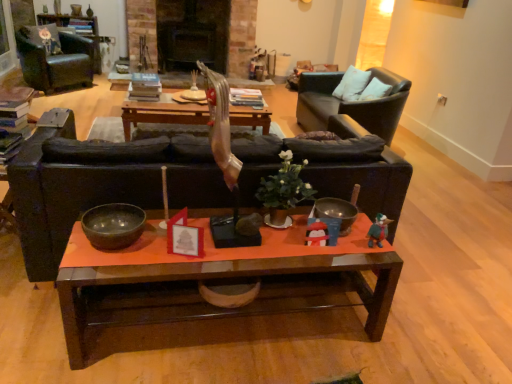
Question: Would you say plush green duck at right is part of white soft pillow at upper right, placed as the first pillow when sorted from front to back,'s contents?

Choices:
 (A) no
 (B) yes

Answer: (A)

Question: Is white soft pillow at upper right, the 2th pillow viewed from the left, next to plush green duck at right?

Choices:
 (A) no
 (B) yes

Answer: (A)

Question: Is white soft pillow at upper right, placed as the first pillow when sorted from front to back, facing away from plush green duck at right?

Choices:
 (A) no
 (B) yes

Answer: (A)

Question: Does white soft pillow at upper right, placed as the first pillow when sorted from front to back, appear on the right side of plush green duck at right?

Choices:
 (A) no
 (B) yes

Answer: (B)

Question: Is white soft pillow at upper right, positioned as the 1th pillow in right-to-left order, thinner than plush green duck at right?

Choices:
 (A) no
 (B) yes

Answer: (A)

Question: Relative to plush green duck at right, is wooden coffee table at center, which is the second coffee table from front to back, in front or behind?

Choices:
 (A) front
 (B) behind

Answer: (B)

Question: Choose the correct answer: Is wooden coffee table at center, which is the second coffee table from front to back, inside plush green duck at right or outside it?

Choices:
 (A) inside
 (B) outside

Answer: (B)

Question: Considering the positions of point (249, 122) and point (377, 228), is point (249, 122) closer or farther from the camera than point (377, 228)?

Choices:
 (A) closer
 (B) farther

Answer: (B)

Question: In terms of size, does wooden coffee table at center, which ranks as the 1th coffee table in back-to-front order, appear bigger or smaller than plush green duck at right?

Choices:
 (A) big
 (B) small

Answer: (A)

Question: Does point (88, 226) appear closer or farther from the camera than point (390, 221)?

Choices:
 (A) closer
 (B) farther

Answer: (A)

Question: Based on their sizes in the image, would you say shiny dark wood bowl at center, placed as the second bowl when sorted from right to left, is bigger or smaller than plush green duck at right?

Choices:
 (A) big
 (B) small

Answer: (A)

Question: From their relative heights in the image, would you say shiny dark wood bowl at center, which is counted as the second bowl, starting from the back, is taller or shorter than plush green duck at right?

Choices:
 (A) short
 (B) tall

Answer: (A)

Question: From the image's perspective, relative to plush green duck at right, is shiny dark wood bowl at center, placed as the second bowl when sorted from right to left, above or below?

Choices:
 (A) below
 (B) above

Answer: (B)

Question: Is point (130, 236) positioned closer to the camera than point (368, 117)?

Choices:
 (A) farther
 (B) closer

Answer: (B)

Question: Considering their positions, is shiny dark wood bowl at center, marked as the first bowl in a left-to-right arrangement, located in front of or behind black leather chair at upper right, which is the second chair from left to right?

Choices:
 (A) behind
 (B) front

Answer: (B)